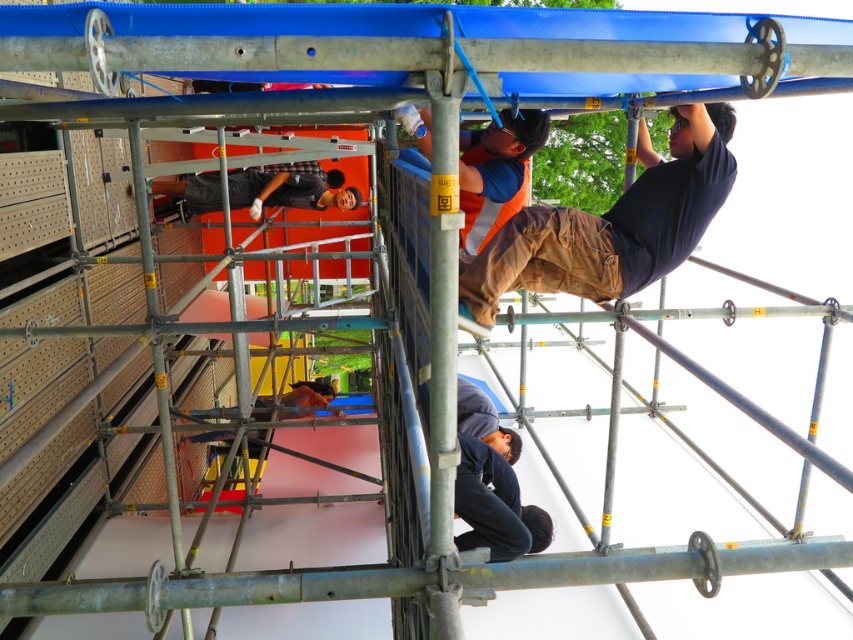
Which is above, orange safety vest at upper center or matte black shirt at center?

matte black shirt at center is above.

Who is more forward, (712,125) or (316,180)?

Point (712,125)

Which is behind, point (634, 182) or point (196, 209)?

The point (196, 209) is behind.

At what (x,y) coordinates should I click in order to perform the action: click on orange safety vest at upper center. Please return your answer as a coordinate pair (x, y). Looking at the image, I should click on (612, 225).

Which is below, orange reflective vest at upper center or matte black shirt at center?

orange reflective vest at upper center is lower down.

Is orange reflective vest at upper center bigger than matte black shirt at center?

No, orange reflective vest at upper center is not bigger than matte black shirt at center.

I want to click on orange reflective vest at upper center, so click(496, 172).

Find the location of a particular element. orange reflective vest at upper center is located at coordinates (496, 172).

Who is lower down, orange safety vest at upper center or orange reflective vest at upper center?

orange safety vest at upper center is below.

Measure the distance between orange safety vest at upper center and camera.

orange safety vest at upper center and camera are 3.29 meters apart.

This screenshot has width=853, height=640. I want to click on orange safety vest at upper center, so click(612, 225).